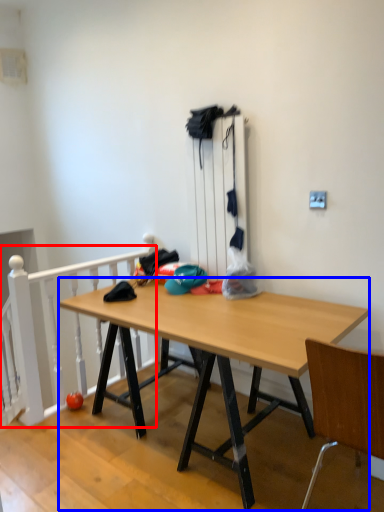
Question: Among these objects, which one is nearest to the camera, rail (highlighted by a red box) or desk (highlighted by a blue box)?

Choices:
 (A) rail
 (B) desk

Answer: (B)